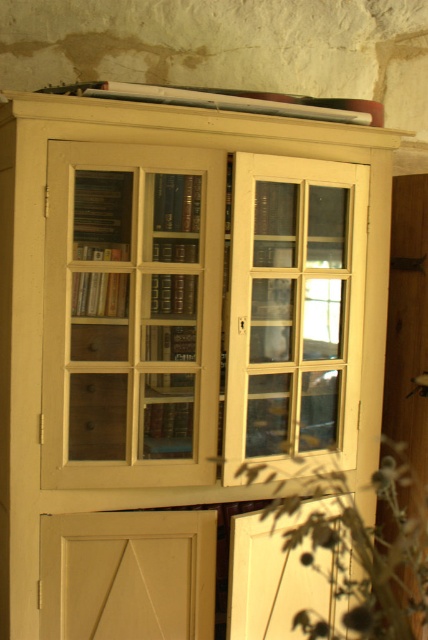
Who is lower down, white matte door at lower left or green leafy plant at lower right?

Positioned lower is white matte door at lower left.

Between white matte door at lower left and green leafy plant at lower right, which one has more height?

green leafy plant at lower right is taller.

Is point (68, 563) positioned after point (323, 524)?

No, it is in front of (323, 524).

The image size is (428, 640). Identify the location of white matte door at lower left. (127, 576).

Is matte wood door at center shorter than clear glass door at center?

No.

Is matte wood door at center in front of clear glass door at center?

Yes, it is.

Does point (58, 372) come in front of point (351, 220)?

Yes, it is in front of point (351, 220).

Where is `matte wood door at center`? The height and width of the screenshot is (640, 428). matte wood door at center is located at coordinates (130, 314).

Which is behind, point (131, 280) or point (391, 486)?

The point (391, 486) is behind.

Between point (186, 317) and point (385, 481), which one is positioned behind?

The point (385, 481) is behind.

The image size is (428, 640). I want to click on matte wood door at center, so click(130, 314).